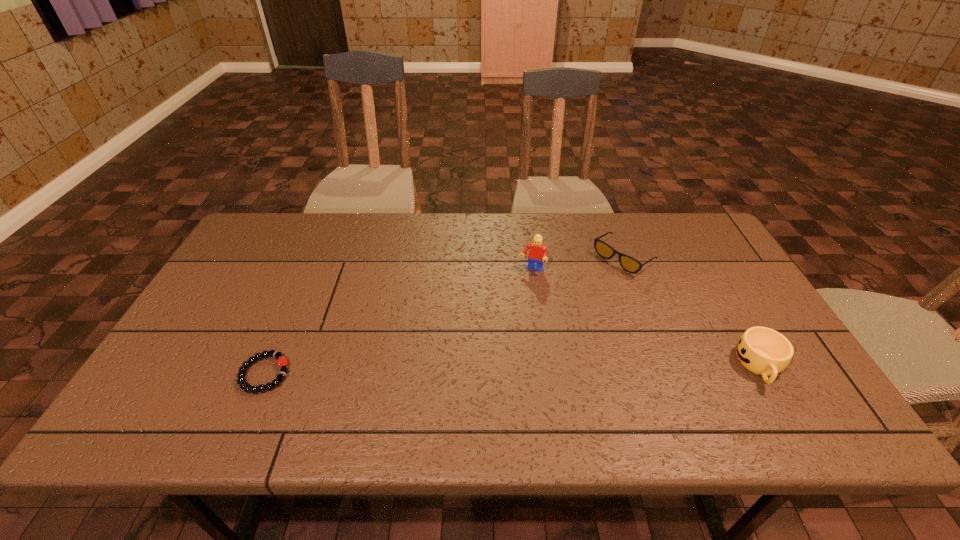
The width and height of the screenshot is (960, 540). Find the location of `free space between the second object from right to left and the rightmost object`. free space between the second object from right to left and the rightmost object is located at coordinates (692, 312).

What are the coordinates of `free space between the sunglasses and the shortest object` in the screenshot? It's located at (444, 316).

You are a GUI agent. You are given a task and a screenshot of the screen. Output one action in this format:
    pyautogui.click(x=<x>, y=<y>)
    Task: Click on the unoccupied area between the rightmost object and the second object from left to right
    
    Given the screenshot: What is the action you would take?
    pyautogui.click(x=646, y=318)

Locate an element on the screen. The height and width of the screenshot is (540, 960). free point between the cup and the Lego is located at coordinates (646, 318).

You are a GUI agent. You are given a task and a screenshot of the screen. Output one action in this format:
    pyautogui.click(x=<x>, y=<y>)
    Task: Click on the empty location between the sunglasses and the leftmost object
    
    Given the screenshot: What is the action you would take?
    pyautogui.click(x=444, y=316)

At what (x,y) coordinates should I click in order to perform the action: click on free spot between the Lego and the rightmost object. Please return your answer as a coordinate pair (x, y). Looking at the image, I should click on (646, 318).

This screenshot has height=540, width=960. I want to click on the third closest object to the shortest object, so click(x=763, y=351).

Find the location of a particular element. Image resolution: width=960 pixels, height=540 pixels. object that can be found as the second closest to the cup is located at coordinates (537, 254).

At what (x,y) coordinates should I click in order to perform the action: click on free spot that satisfies the following two spatial constraints: 1. on the front side of the second object from right to left; 2. on the right side of the cup. Please return your answer as a coordinate pair (x, y). This screenshot has height=540, width=960. Looking at the image, I should click on (664, 366).

The height and width of the screenshot is (540, 960). Find the location of `vacant area that satisfies the following two spatial constraints: 1. on the back side of the tallest object; 2. on the right side of the third object from left to right`. vacant area that satisfies the following two spatial constraints: 1. on the back side of the tallest object; 2. on the right side of the third object from left to right is located at coordinates (530, 258).